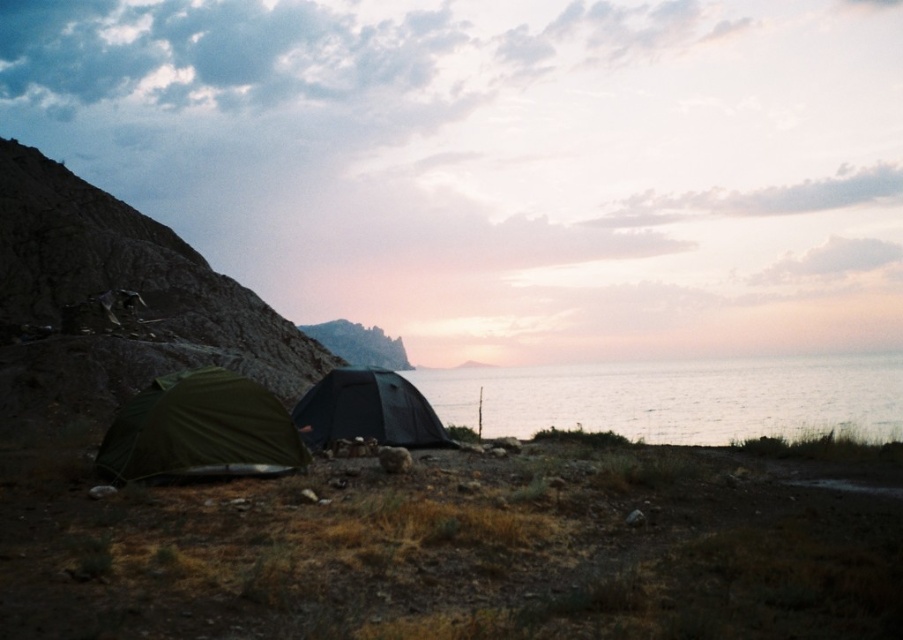
Question: Which point appears farthest from the camera in this image?

Choices:
 (A) (725, 417)
 (B) (435, 417)
 (C) (182, 436)

Answer: (A)

Question: In this image, where is silvery water at center located relative to green fabric tent at lower left?

Choices:
 (A) left
 (B) right

Answer: (B)

Question: Is silvery water at center bigger than black matte tent at lower left?

Choices:
 (A) yes
 (B) no

Answer: (A)

Question: Which of the following is the farthest from the observer?

Choices:
 (A) (309, 413)
 (B) (627, 364)
 (C) (120, 440)

Answer: (B)

Question: Is silvery water at center thinner than green fabric tent at lower left?

Choices:
 (A) no
 (B) yes

Answer: (A)

Question: Which object appears farthest from the camera in this image?

Choices:
 (A) black matte tent at lower left
 (B) green fabric tent at lower left

Answer: (A)